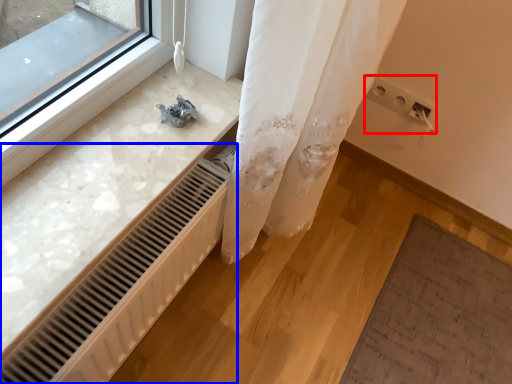
Question: Which object appears closest to the camera in this image, electric outlet (highlighted by a red box) or radiator (highlighted by a blue box)?

Choices:
 (A) electric outlet
 (B) radiator

Answer: (B)